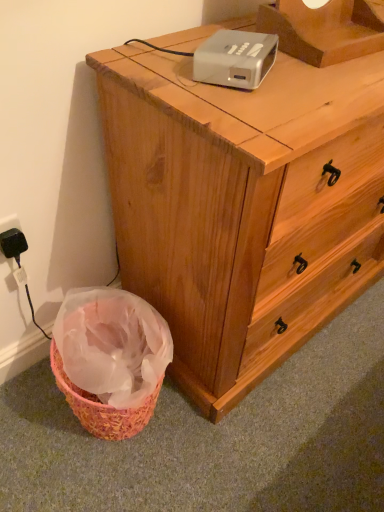
What do you see at coordinates (243, 206) in the screenshot? I see `wooden chest of drawers at center` at bounding box center [243, 206].

At what (x,y) coordinates should I click in order to perform the action: click on black plastic electric outlet at lower left. Please return your answer as a coordinate pair (x, y). This screenshot has height=512, width=384. Looking at the image, I should click on (12, 238).

Who is bigger, black plastic electric outlet at lower left or wooden chest of drawers at center?

Bigger between the two is wooden chest of drawers at center.

Could you measure the distance between black plastic electric outlet at lower left and wooden chest of drawers at center?

20.39 inches.

From the image's perspective, which is below, black plastic electric outlet at lower left or wooden chest of drawers at center?

From the image's view, black plastic electric outlet at lower left is below.

From a real-world perspective, which object rests below the other?

wooden chest of drawers at center is physically lower.

Between point (8, 222) and point (229, 83), which one is positioned behind?

The point (8, 222) is farther.

Where is `gadget that is in front of the black plastic electric outlet at lower left`? The width and height of the screenshot is (384, 512). gadget that is in front of the black plastic electric outlet at lower left is located at coordinates (235, 59).

Which object is positioned more to the left, black plastic electric outlet at lower left or white plastic projector at upper center?

black plastic electric outlet at lower left.

Considering the sizes of black plastic electric outlet at lower left and white plastic projector at upper center in the image, is black plastic electric outlet at lower left wider or thinner than white plastic projector at upper center?

black plastic electric outlet at lower left is thinner than white plastic projector at upper center.

Between wooden chest of drawers at center and black plastic electric outlet at lower left, which one is positioned behind?

Positioned behind is black plastic electric outlet at lower left.

In terms of size, does wooden chest of drawers at center appear bigger or smaller than black plastic electric outlet at lower left?

In the image, wooden chest of drawers at center appears to be larger than black plastic electric outlet at lower left.

Does wooden chest of drawers at center have a greater height compared to black plastic electric outlet at lower left?

Yes.

What's the angular difference between wooden chest of drawers at center and black plastic electric outlet at lower left's facing directions?

The angle between the facing direction of wooden chest of drawers at center and the facing direction of black plastic electric outlet at lower left is 1.41 degrees.

In the scene shown: Is white plastic projector at upper center positioned with its back to wooden chest of drawers at center?

Yes, white plastic projector at upper center's orientation is away from wooden chest of drawers at center.

Considering the points (229, 68) and (114, 129), which point is behind, point (229, 68) or point (114, 129)?

The point (114, 129) is farther from the camera.

In the image, there is a wooden chest of drawers at center. Where is `gadget above it (from the image's perspective)`? The width and height of the screenshot is (384, 512). gadget above it (from the image's perspective) is located at coordinates (235, 59).

Who is bigger, white plastic projector at upper center or wooden chest of drawers at center?

Bigger between the two is wooden chest of drawers at center.

Is wooden chest of drawers at center not within white plastic projector at upper center?

That's correct, wooden chest of drawers at center is outside of white plastic projector at upper center.

From a real-world perspective, is wooden chest of drawers at center positioned under white plastic projector at upper center based on gravity?

Yes, from a real-world perspective, wooden chest of drawers at center is below white plastic projector at upper center.

Considering the relative sizes of wooden chest of drawers at center and white plastic projector at upper center in the image provided, is wooden chest of drawers at center bigger than white plastic projector at upper center?

Indeed, wooden chest of drawers at center has a larger size compared to white plastic projector at upper center.

Can you see wooden chest of drawers at center touching white plastic projector at upper center?

wooden chest of drawers at center and white plastic projector at upper center are clearly separated.

From a real-world perspective, is white plastic projector at upper center positioned above or below black plastic electric outlet at lower left?

Clearly, from a real-world perspective, white plastic projector at upper center is above black plastic electric outlet at lower left.

Can black plastic electric outlet at lower left be found inside white plastic projector at upper center?

No, black plastic electric outlet at lower left is not a part of white plastic projector at upper center.

From the image's perspective, is white plastic projector at upper center on top of black plastic electric outlet at lower left?

Correct, white plastic projector at upper center appears higher than black plastic electric outlet at lower left in the image.

Based on their sizes in the image, would you say white plastic projector at upper center is bigger or smaller than black plastic electric outlet at lower left?

Clearly, white plastic projector at upper center is larger in size than black plastic electric outlet at lower left.

This screenshot has width=384, height=512. I want to click on electric outlet above the wooden chest of drawers at center (from a real-world perspective), so click(12, 238).

In the image, there is a black plastic electric outlet at lower left. Where is `gadget above it (from the image's perspective)`? gadget above it (from the image's perspective) is located at coordinates (235, 59).

When comparing their distances from black plastic electric outlet at lower left, does wooden chest of drawers at center or white plastic projector at upper center seem further?

The object further to black plastic electric outlet at lower left is white plastic projector at upper center.

Which object lies nearer to the anchor point black plastic electric outlet at lower left, white plastic projector at upper center or wooden chest of drawers at center?

wooden chest of drawers at center is positioned closer to the anchor black plastic electric outlet at lower left.

From the image, which object appears to be nearer to white plastic projector at upper center, black plastic electric outlet at lower left or wooden chest of drawers at center?

Based on the image, wooden chest of drawers at center appears to be nearer to white plastic projector at upper center.

Estimate the real-world distances between objects in this image. Which object is closer to wooden chest of drawers at center, black plastic electric outlet at lower left or white plastic projector at upper center?

white plastic projector at upper center lies closer to wooden chest of drawers at center than the other object.

In the scene shown: Looking at the image, which one is located closer to wooden chest of drawers at center, white plastic projector at upper center or black plastic electric outlet at lower left?

white plastic projector at upper center is closer to wooden chest of drawers at center.

Estimate the real-world distances between objects in this image. Which object is closer to white plastic projector at upper center, wooden chest of drawers at center or black plastic electric outlet at lower left?

wooden chest of drawers at center.

Image resolution: width=384 pixels, height=512 pixels. I want to click on gadget between black plastic electric outlet at lower left and wooden chest of drawers at center in the horizontal direction, so click(x=235, y=59).